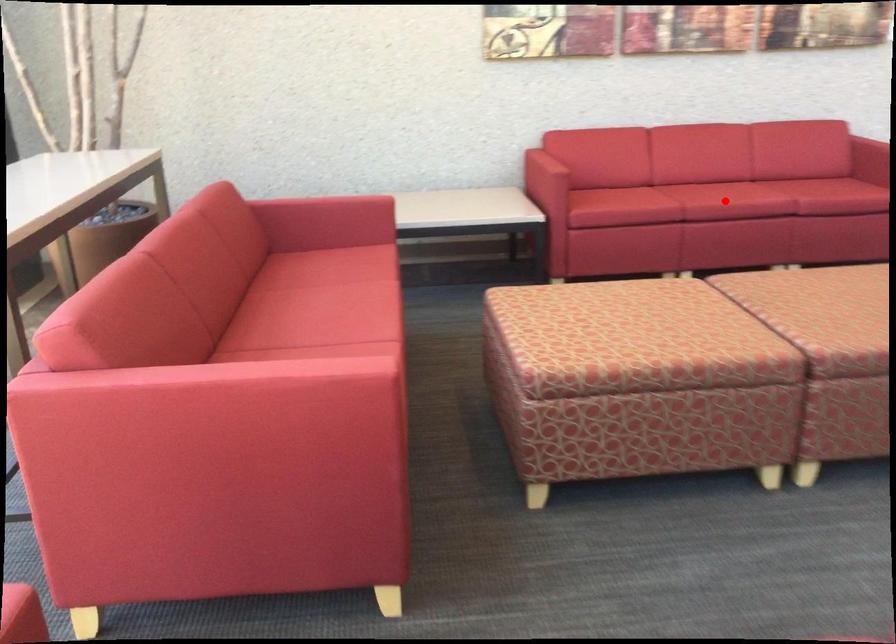
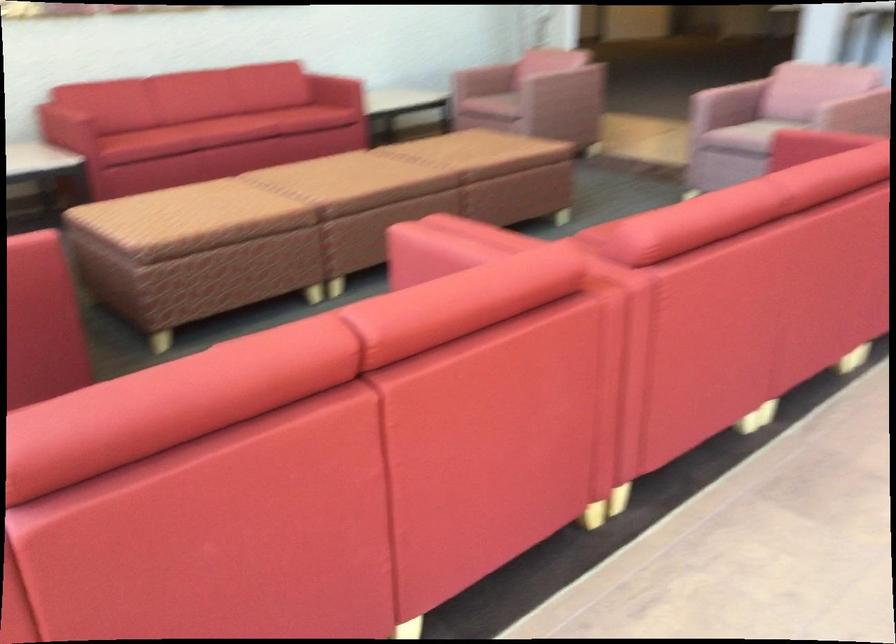
Question: I am providing you with two images of the same scene from different viewpoints. Given a red point in image1, look at the same physical point in image2. Is it:

Choices:
 (A) Closer to the viewpoint
 (B) Farther from the viewpoint

Answer: (B)